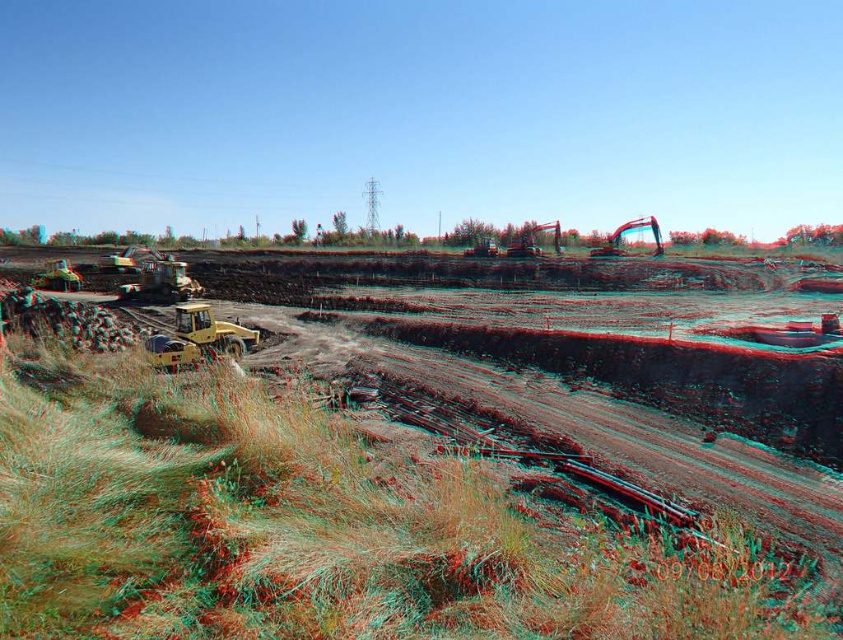
Question: Among these objects, which one is farthest from the camera?

Choices:
 (A) yellow rubber excavator at lower left
 (B) yellow rubber at center
 (C) metallic yellow excavator at center right

Answer: (C)

Question: Which point appears closest to the camera in this image?

Choices:
 (A) (651, 227)
 (B) (19, 355)
 (C) (194, 344)

Answer: (B)

Question: Is yellow rubber excavator at lower left wider than metallic yellow excavator at center right?

Choices:
 (A) yes
 (B) no

Answer: (A)

Question: Estimate the real-world distances between objects in this image. Which object is closer to the yellow rubber at center?

Choices:
 (A) yellow rubber excavator at lower left
 (B) metallic yellow excavator at center right

Answer: (A)

Question: Is yellow rubber at center closer to the viewer compared to yellow rubber excavator at lower left?

Choices:
 (A) no
 (B) yes

Answer: (B)

Question: Observing the image, what is the correct spatial positioning of yellow rubber at center in reference to metallic yellow excavator at center right?

Choices:
 (A) left
 (B) right

Answer: (A)